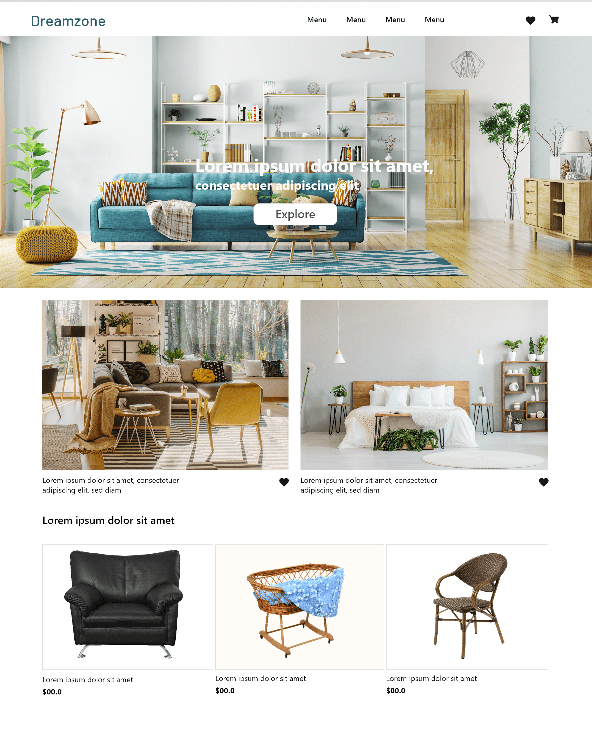
I want to click on rug, so click(x=199, y=258), click(x=57, y=442), click(x=469, y=453).